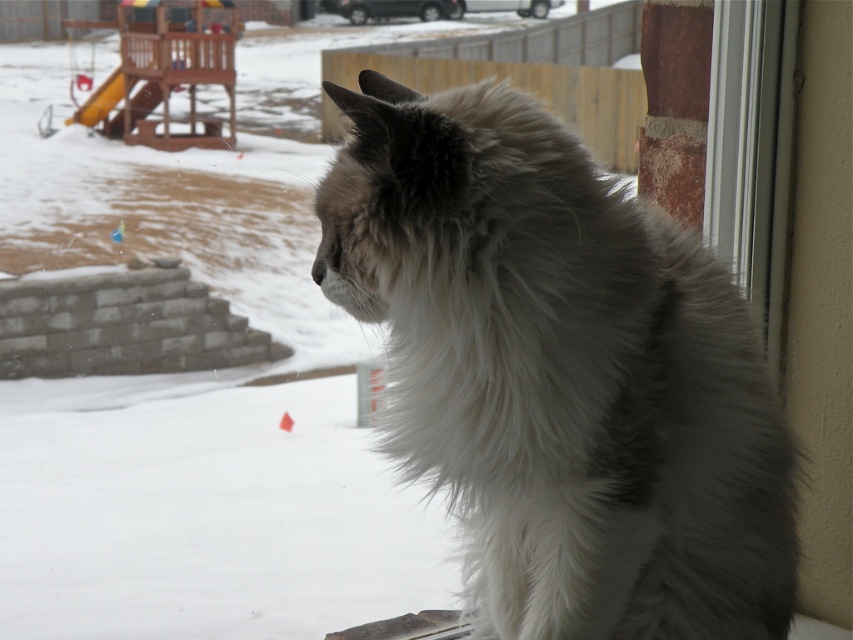
Question: Where is white fluffy cat at right located in relation to clear glass window at upper right in the image?

Choices:
 (A) right
 (B) left

Answer: (B)

Question: Which point is closer to the camera?

Choices:
 (A) (670, 228)
 (B) (776, 188)

Answer: (A)

Question: Can you confirm if white fluffy cat at right is bigger than clear glass window at upper right?

Choices:
 (A) no
 (B) yes

Answer: (B)

Question: Does white fluffy cat at right have a smaller size compared to clear glass window at upper right?

Choices:
 (A) yes
 (B) no

Answer: (B)

Question: Among these points, which one is farthest from the camera?

Choices:
 (A) (610, 460)
 (B) (770, 253)

Answer: (B)